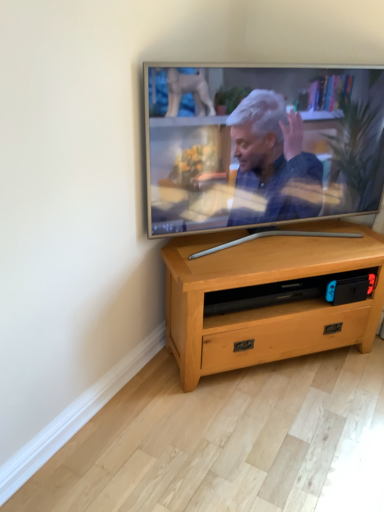
Question: Is silver metallic television at upper center spatially inside light wood/texture tv stand at center, or outside of it?

Choices:
 (A) inside
 (B) outside

Answer: (B)

Question: From the image's perspective, is silver metallic television at upper center positioned above or below light wood/texture tv stand at center?

Choices:
 (A) above
 (B) below

Answer: (A)

Question: Considering the positions of silver metallic television at upper center and light wood/texture tv stand at center in the image, is silver metallic television at upper center taller or shorter than light wood/texture tv stand at center?

Choices:
 (A) tall
 (B) short

Answer: (A)

Question: Is light wood/texture tv stand at center spatially inside silver metallic television at upper center, or outside of it?

Choices:
 (A) inside
 (B) outside

Answer: (B)

Question: From their relative heights in the image, would you say light wood/texture tv stand at center is taller or shorter than silver metallic television at upper center?

Choices:
 (A) short
 (B) tall

Answer: (A)

Question: Considering the positions of light wood/texture tv stand at center and silver metallic television at upper center in the image, is light wood/texture tv stand at center wider or thinner than silver metallic television at upper center?

Choices:
 (A) thin
 (B) wide

Answer: (B)

Question: From the image's perspective, is light wood/texture tv stand at center positioned above or below silver metallic television at upper center?

Choices:
 (A) below
 (B) above

Answer: (A)